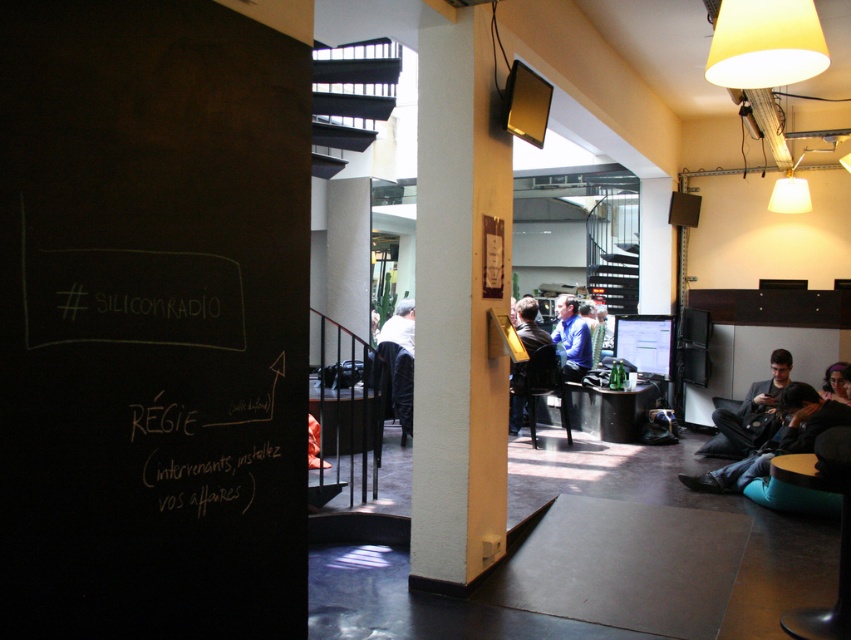
Question: Does white textured pillar at center appear on the right side of dark blue jeans at lower right?

Choices:
 (A) no
 (B) yes

Answer: (A)

Question: Based on their relative distances, which object is farther from the black chalkboard at left?

Choices:
 (A) blue fabric shirt at center
 (B) dark blue jeans at lower right
 (C) light brown leather jacket at center

Answer: (A)

Question: Based on their relative distances, which object is nearer to the light brown leather jacket at center?

Choices:
 (A) dark gray suit at lower right
 (B) black chalkboard at left
 (C) dark blue jeans at lower right
 (D) white textured pillar at center

Answer: (A)

Question: In this image, where is white chalk writing at left located relative to dark gray suit at lower right?

Choices:
 (A) above
 (B) below

Answer: (A)

Question: Is black chalkboard at left to the right of dark blue jeans at lower right from the viewer's perspective?

Choices:
 (A) no
 (B) yes

Answer: (A)

Question: Which object appears closest to the camera in this image?

Choices:
 (A) dark blue shirt at center
 (B) white chalk writing at upper center

Answer: (B)